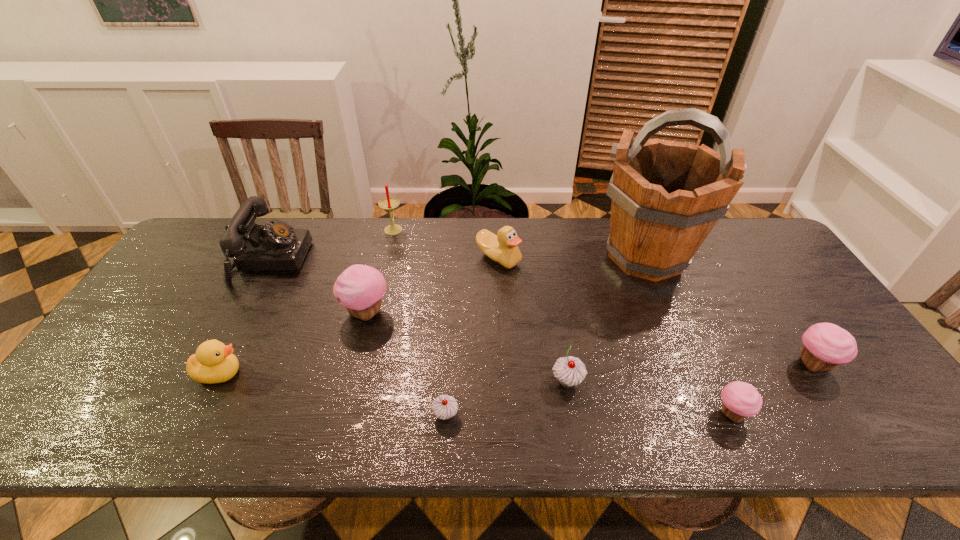
Locate an element on the screen. Image resolution: width=960 pixels, height=540 pixels. the second smallest pink cupcake is located at coordinates (825, 345).

Locate an element on the screen. Image resolution: width=960 pixels, height=540 pixels. yellow duckling is located at coordinates (213, 362).

This screenshot has width=960, height=540. I want to click on the sixth object from right to left, so click(444, 407).

The width and height of the screenshot is (960, 540). In order to click on the nearer gray cupcake in this screenshot , I will do `click(444, 407)`.

I want to click on the nearest pink cupcake, so click(x=740, y=400).

Where is `the fourth cupcake from left to right`? the fourth cupcake from left to right is located at coordinates (740, 400).

This screenshot has height=540, width=960. I want to click on vacant region located 0.270m on the front of the tallest object, so click(695, 372).

What are the coordinates of `free point located on the right of the candle` in the screenshot? It's located at (443, 228).

The image size is (960, 540). Identify the location of vacant space located 0.090m on the dial of the black telephone. (335, 260).

At what (x,y) coordinates should I click in order to perform the action: click on vacant space located on the left of the tallest cupcake. Please return your answer as a coordinate pair (x, y). The width and height of the screenshot is (960, 540). Looking at the image, I should click on (218, 313).